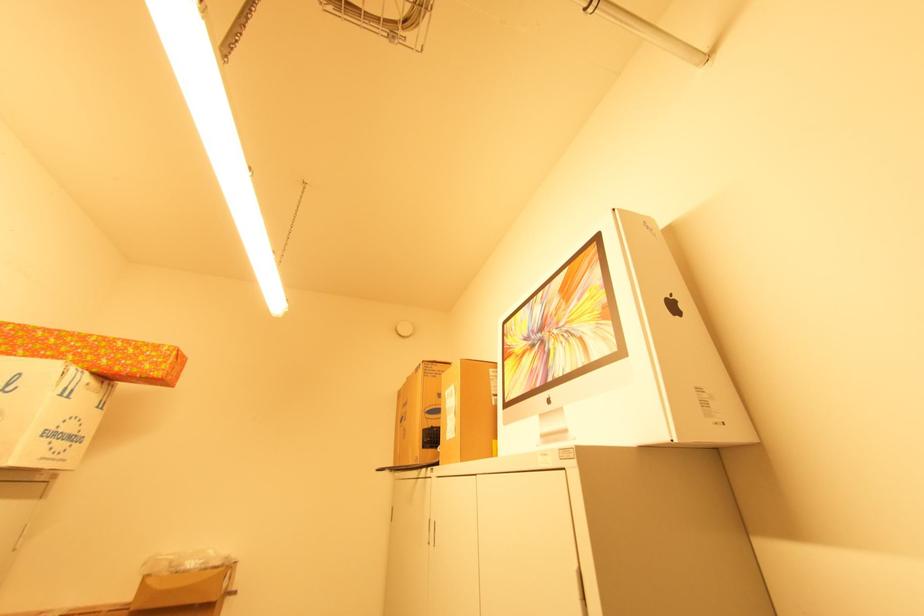
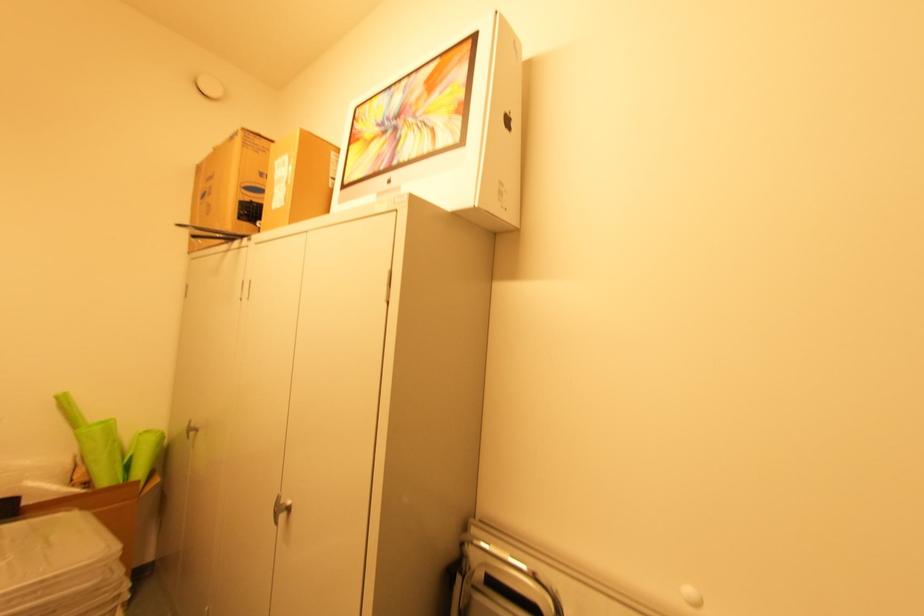
The point at [409,379] is marked in the first image. Where is the corresponding point in the second image?

(216, 148)